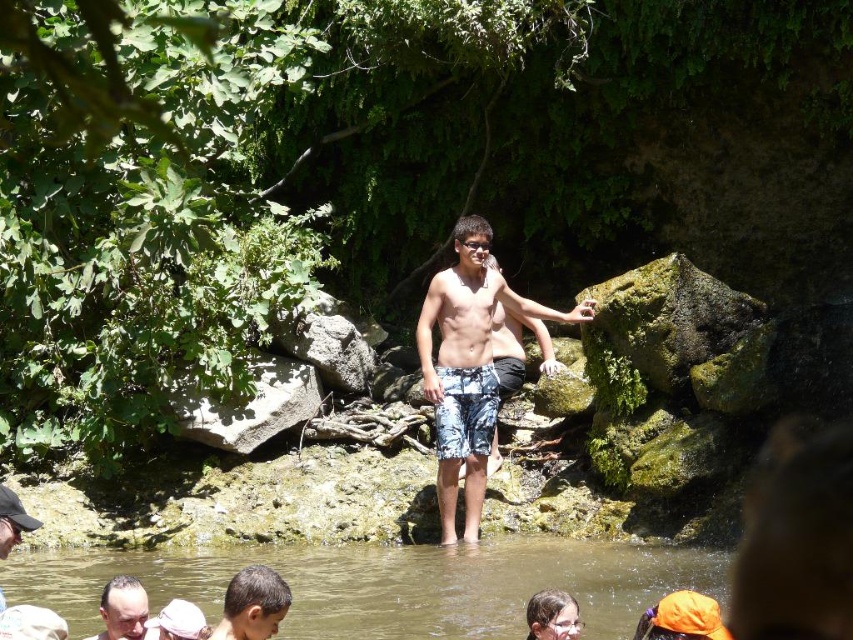
Does brown smooth water at lower center appear under dark brown hair at lower left?

Indeed, brown smooth water at lower center is positioned under dark brown hair at lower left.

Locate an element on the screen. The height and width of the screenshot is (640, 853). brown smooth water at lower center is located at coordinates (386, 582).

Find the location of a particular element. brown smooth water at lower center is located at coordinates (386, 582).

Does brown smooth water at lower center have a greater width compared to camouflage shorts at center?

Indeed, brown smooth water at lower center has a greater width compared to camouflage shorts at center.

Can you confirm if brown smooth water at lower center is taller than camouflage shorts at center?

No, brown smooth water at lower center is not taller than camouflage shorts at center.

Is point (535, 568) positioned in front of point (444, 300)?

Yes, it is in front of point (444, 300).

Find the location of a particular element. brown smooth water at lower center is located at coordinates (386, 582).

Does camouflage shorts at center appear on the right side of smooth brown hair at lower center?

Correct, you'll find camouflage shorts at center to the right of smooth brown hair at lower center.

The height and width of the screenshot is (640, 853). Find the location of `camouflage shorts at center`. camouflage shorts at center is located at coordinates (468, 365).